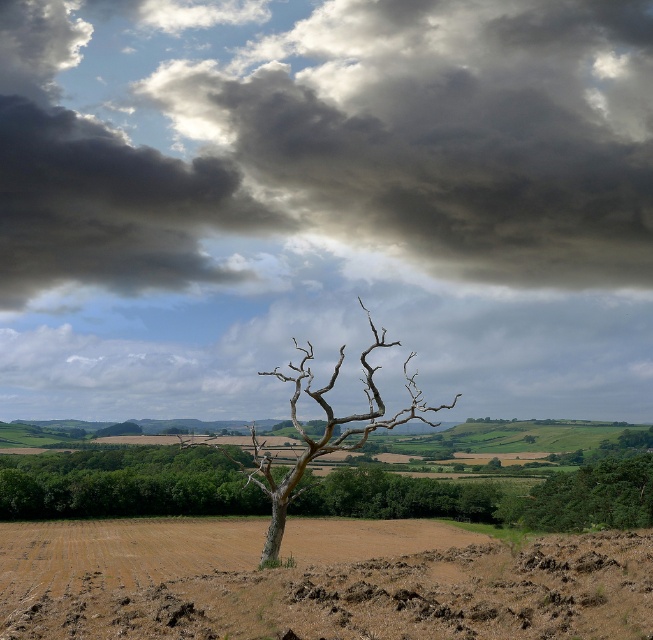
Question: Does brown soil at center have a smaller size compared to green leafy tree at right?

Choices:
 (A) no
 (B) yes

Answer: (A)

Question: Does brown bark tree at center appear on the right side of green leafy tree at right?

Choices:
 (A) yes
 (B) no

Answer: (B)

Question: Does dark gray cloud at upper center appear on the left side of green leafy tree at right?

Choices:
 (A) no
 (B) yes

Answer: (B)

Question: Which object appears farthest from the camera in this image?

Choices:
 (A) green leafy tree at right
 (B) brown soil at center

Answer: (A)

Question: Which point is farther from the camera taking this photo?

Choices:
 (A) (x=191, y=193)
 (B) (x=263, y=472)
 (C) (x=631, y=488)
 (D) (x=441, y=561)

Answer: (A)

Question: Which object is positioned farthest from the brown soil at center?

Choices:
 (A) green leafy tree at right
 (B) dark gray cloud at upper center

Answer: (B)